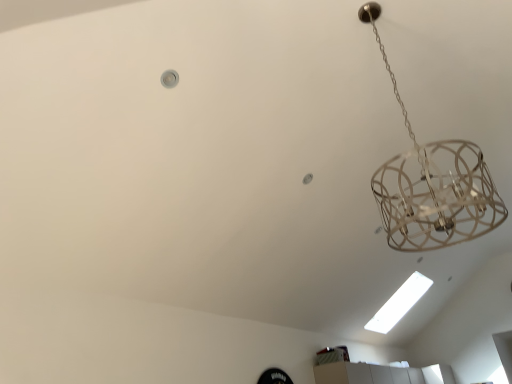
Identify the location of white fluorescent light at upper center. (399, 303).

Describe the element at coordinates (399, 303) in the screenshot. I see `white fluorescent light at upper center` at that location.

Based on the photo, what is the approximate height of metallic wire chandelier at upper right?

3.54 inches.

Describe the element at coordinates (433, 186) in the screenshot. Image resolution: width=512 pixels, height=384 pixels. I see `metallic wire chandelier at upper right` at that location.

Find the location of a particular element. metallic wire chandelier at upper right is located at coordinates (433, 186).

The image size is (512, 384). Identify the location of white fluorescent light at upper center. (399, 303).

Is metallic wire chandelier at upper right to the left of white fluorescent light at upper center from the viewer's perspective?

Incorrect, metallic wire chandelier at upper right is not on the left side of white fluorescent light at upper center.

Consider the image. Which object is closer to the camera, metallic wire chandelier at upper right or white fluorescent light at upper center?

metallic wire chandelier at upper right is in front.

Which point is more distant from viewer, (380, 205) or (415, 272)?

The point (415, 272) is farther from the camera.

From the image's perspective, which object appears higher, metallic wire chandelier at upper right or white fluorescent light at upper center?

metallic wire chandelier at upper right appears higher in the image.

From a real-world perspective, which object stands above the other?

From a 3D spatial view, metallic wire chandelier at upper right is above.

Is metallic wire chandelier at upper right wider than white fluorescent light at upper center?

Correct, the width of metallic wire chandelier at upper right exceeds that of white fluorescent light at upper center.

Does metallic wire chandelier at upper right have a greater height compared to white fluorescent light at upper center?

No, metallic wire chandelier at upper right is not taller than white fluorescent light at upper center.

Which of these two, metallic wire chandelier at upper right or white fluorescent light at upper center, is bigger?

white fluorescent light at upper center is bigger.

In the scene shown: Is white fluorescent light at upper center a part of metallic wire chandelier at upper right?

No, white fluorescent light at upper center is located outside of metallic wire chandelier at upper right.

Looking at this image, is metallic wire chandelier at upper right positioned far away from white fluorescent light at upper center?

Absolutely, metallic wire chandelier at upper right is distant from white fluorescent light at upper center.

Is metallic wire chandelier at upper right facing away from white fluorescent light at upper center?

metallic wire chandelier at upper right is not turned away from white fluorescent light at upper center.

What's the angular difference between metallic wire chandelier at upper right and white fluorescent light at upper center's facing directions?

90.6 degrees separate the facing orientations of metallic wire chandelier at upper right and white fluorescent light at upper center.

This screenshot has height=384, width=512. Find the location of `light bulb below the metallic wire chandelier at upper right (from a real-world perspective)`. light bulb below the metallic wire chandelier at upper right (from a real-world perspective) is located at coordinates (399, 303).

Which is more to the left, white fluorescent light at upper center or metallic wire chandelier at upper right?

white fluorescent light at upper center.

Is the position of white fluorescent light at upper center more distant than that of metallic wire chandelier at upper right?

Yes, it is behind metallic wire chandelier at upper right.

From the picture: Which is closer to the camera, [386,330] or [481,152]?

The point [481,152] is closer.

From the image's perspective, which object appears higher, white fluorescent light at upper center or metallic wire chandelier at upper right?

metallic wire chandelier at upper right is shown above in the image.

From a real-world perspective, which object rests below the other?

white fluorescent light at upper center.

Consider the image. Can you confirm if white fluorescent light at upper center is wider than metallic wire chandelier at upper right?

No.

Between white fluorescent light at upper center and metallic wire chandelier at upper right, which one has less height?

metallic wire chandelier at upper right is shorter.

Looking at the image, does white fluorescent light at upper center seem bigger or smaller compared to metallic wire chandelier at upper right?

In the image, white fluorescent light at upper center appears to be larger than metallic wire chandelier at upper right.

Is white fluorescent light at upper center completely or partially outside of metallic wire chandelier at upper right?

white fluorescent light at upper center lies outside metallic wire chandelier at upper right's area.

Is white fluorescent light at upper center far away from metallic wire chandelier at upper right?

Yes, white fluorescent light at upper center and metallic wire chandelier at upper right are located far from each other.

Is white fluorescent light at upper center facing away from metallic wire chandelier at upper right?

white fluorescent light at upper center is not turned away from metallic wire chandelier at upper right.

How many degrees apart are the facing directions of white fluorescent light at upper center and metallic wire chandelier at upper right?

They differ by 90.6 degrees in their facing directions.

The width and height of the screenshot is (512, 384). Identify the location of light bulb below the metallic wire chandelier at upper right (from the image's perspective). (399, 303).

Image resolution: width=512 pixels, height=384 pixels. What are the coordinates of `light bulb behind the metallic wire chandelier at upper right` in the screenshot? It's located at (399, 303).

Locate an element on the screen. The image size is (512, 384). lamp lying on the right of white fluorescent light at upper center is located at coordinates (x=433, y=186).